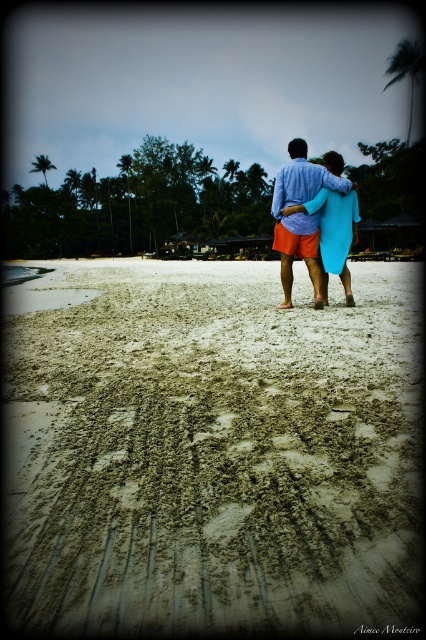
Question: Is brown sandy beach at center positioned behind matte blue surfboard at center?

Choices:
 (A) no
 (B) yes

Answer: (A)

Question: Is brown sandy beach at center positioned in front of matte blue surfboard at center?

Choices:
 (A) yes
 (B) no

Answer: (A)

Question: Can you confirm if brown sandy beach at center is smaller than matte blue surfboard at center?

Choices:
 (A) yes
 (B) no

Answer: (A)